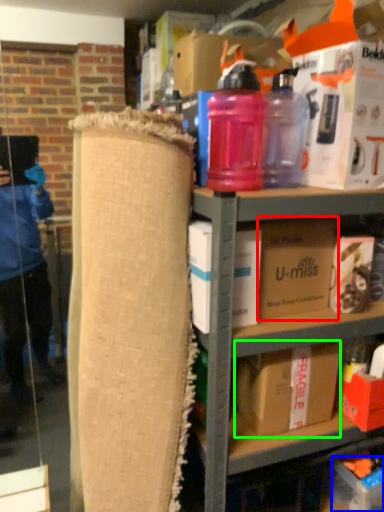
Question: Based on their relative distances, which object is nearer to box (highlighted by a red box)? Choose from cardboard box (highlighted by a blue box) and box (highlighted by a green box).

Choices:
 (A) cardboard box
 (B) box

Answer: (B)